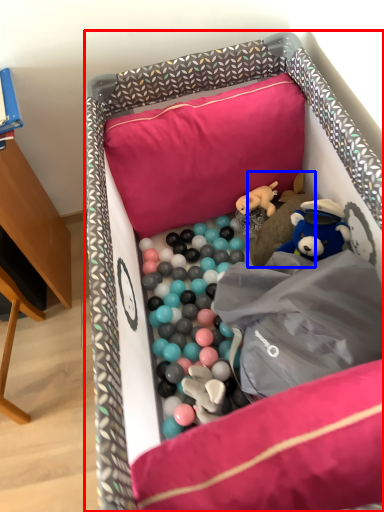
Question: Which of the following is the closest to the observer, infant bed (highlighted by a red box) or toy (highlighted by a blue box)?

Choices:
 (A) infant bed
 (B) toy

Answer: (A)